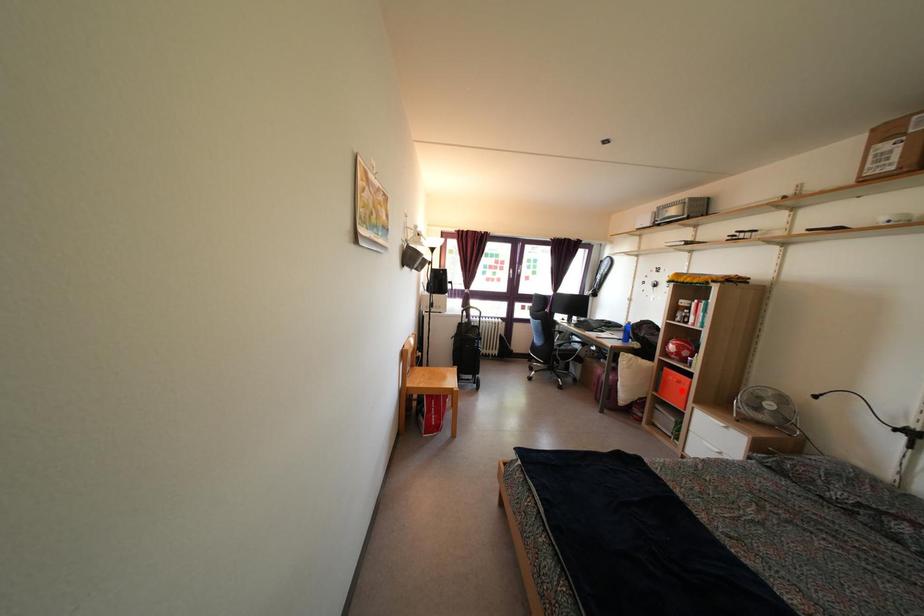
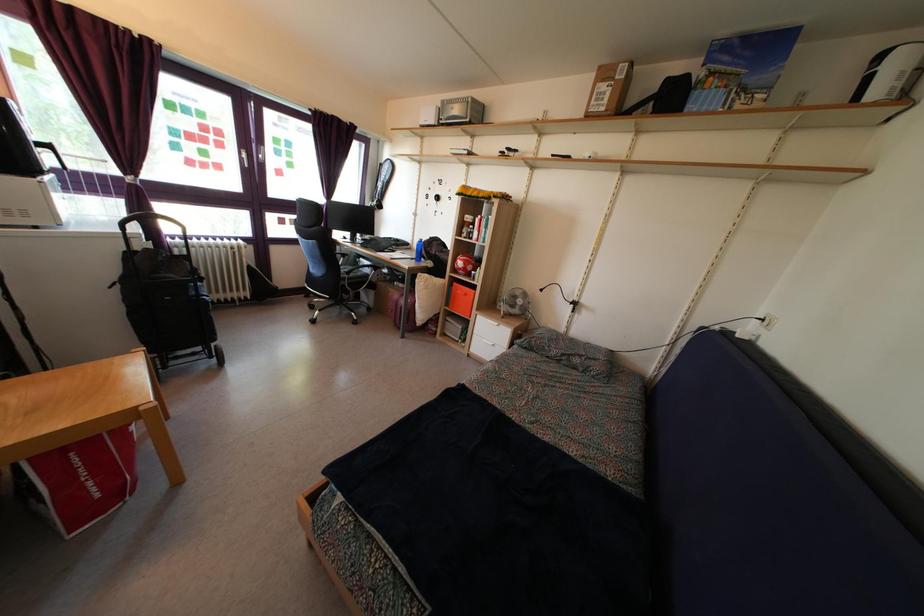
Question: I am providing you with two images of the same scene from different viewpoints. Image1 has a red point marked. In image2, the corresponding 3D location appears at what relative position? Reply with the corresponding letter.

Choices:
 (A) Closer
 (B) Farther

Answer: (B)